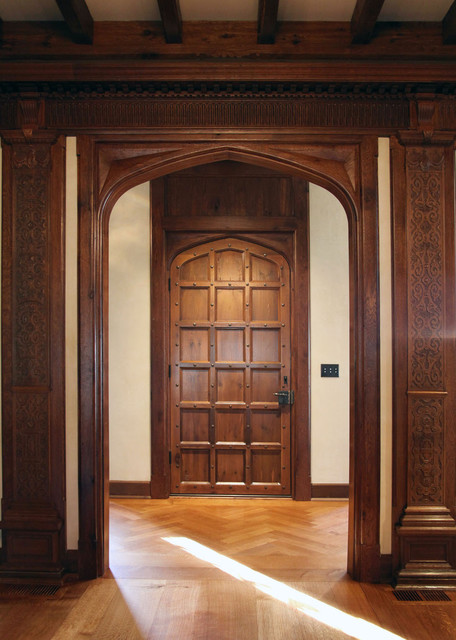
Identify the location of white wall. (119, 256), (327, 332).